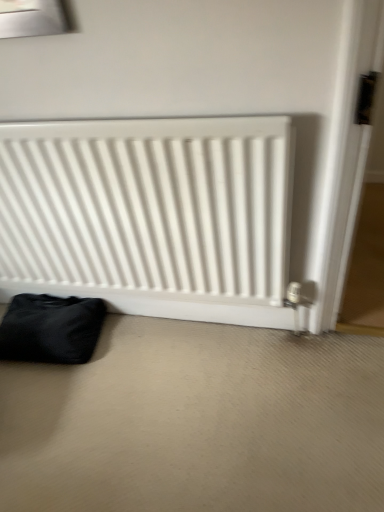
Describe the element at coordinates (147, 208) in the screenshot. The image size is (384, 512). I see `white matte radiator at center` at that location.

I want to click on white matte radiator at center, so click(x=147, y=208).

Describe the element at coordinates (51, 329) in the screenshot. Image resolution: width=384 pixels, height=512 pixels. I see `black fabric bag at lower left` at that location.

You are a GUI agent. You are given a task and a screenshot of the screen. Output one action in this format:
    pyautogui.click(x=<x>, y=<y>)
    Task: Click on the black fabric bag at lower left
    
    Given the screenshot: What is the action you would take?
    pyautogui.click(x=51, y=329)

In order to face black fabric bag at lower left, should I rotate leftwards or rightwards?

Turn left approximately 19.252 degrees to face it.

Locate an element on the screen. white matte radiator at center is located at coordinates (147, 208).

From the picture: Between white matte radiator at center and black fabric bag at lower left, which one appears on the right side from the viewer's perspective?

white matte radiator at center is more to the right.

Is white matte radiator at center positioned behind black fabric bag at lower left?

No.

Does point (130, 185) come closer to viewer compared to point (45, 317)?

Yes, point (130, 185) is closer to viewer.

From the image's perspective, is white matte radiator at center above black fabric bag at lower left?

Indeed, from the image's perspective, white matte radiator at center is shown above black fabric bag at lower left.

From a real-world perspective, does white matte radiator at center sit lower than black fabric bag at lower left?

No, from a real-world perspective, white matte radiator at center is not beneath black fabric bag at lower left.

Can you confirm if white matte radiator at center is thinner than black fabric bag at lower left?

Correct, the width of white matte radiator at center is less than that of black fabric bag at lower left.

In terms of height, does white matte radiator at center look taller or shorter compared to black fabric bag at lower left?

white matte radiator at center is taller than black fabric bag at lower left.

Considering the relative sizes of white matte radiator at center and black fabric bag at lower left in the image provided, is white matte radiator at center smaller than black fabric bag at lower left?

No.

Is white matte radiator at center inside the boundaries of black fabric bag at lower left, or outside?

white matte radiator at center cannot be found inside black fabric bag at lower left.

Is white matte radiator at center positioned far away from black fabric bag at lower left?

No.

In the scene shown: Is white matte radiator at center looking in the opposite direction of black fabric bag at lower left?

Yes.

Measure the distance between white matte radiator at center and black fabric bag at lower left.

white matte radiator at center and black fabric bag at lower left are 17.18 inches apart.

I want to click on furniture that appears below the white matte radiator at center (from a real-world perspective), so click(x=51, y=329).

Considering the positions of objects black fabric bag at lower left and white matte radiator at center in the image provided, who is more to the left, black fabric bag at lower left or white matte radiator at center?

black fabric bag at lower left.

Who is more distant, black fabric bag at lower left or white matte radiator at center?

black fabric bag at lower left is more distant.

Which point is more forward, (66, 310) or (269, 181)?

The point (269, 181) is in front.

From the image's perspective, which is below, black fabric bag at lower left or white matte radiator at center?

black fabric bag at lower left is shown below in the image.

From a real-world perspective, who is located higher, black fabric bag at lower left or white matte radiator at center?

white matte radiator at center.

Considering the relative sizes of black fabric bag at lower left and white matte radiator at center in the image provided, is black fabric bag at lower left wider than white matte radiator at center?

Correct, the width of black fabric bag at lower left exceeds that of white matte radiator at center.

Considering the relative sizes of black fabric bag at lower left and white matte radiator at center in the image provided, is black fabric bag at lower left shorter than white matte radiator at center?

Correct, black fabric bag at lower left is not as tall as white matte radiator at center.

Who is bigger, black fabric bag at lower left or white matte radiator at center?

With larger size is white matte radiator at center.

Would you say black fabric bag at lower left is outside white matte radiator at center?

Yes, black fabric bag at lower left is outside of white matte radiator at center.

Is black fabric bag at lower left touching white matte radiator at center?

No, black fabric bag at lower left is not with white matte radiator at center.

Is black fabric bag at lower left oriented away from white matte radiator at center?

Absolutely, black fabric bag at lower left is directed away from white matte radiator at center.

How different are the orientations of black fabric bag at lower left and white matte radiator at center in degrees?

4.17 degrees.

Identify the location of furniture located below the white matte radiator at center (from the image's perspective). (51, 329).

The width and height of the screenshot is (384, 512). In order to click on furniture beneath the white matte radiator at center (from a real-world perspective) in this screenshot , I will do `click(51, 329)`.

You are a GUI agent. You are given a task and a screenshot of the screen. Output one action in this format:
    pyautogui.click(x=<x>, y=<y>)
    Task: Click on the furniture behind the white matte radiator at center
    The image size is (384, 512).
    Given the screenshot: What is the action you would take?
    pyautogui.click(x=51, y=329)